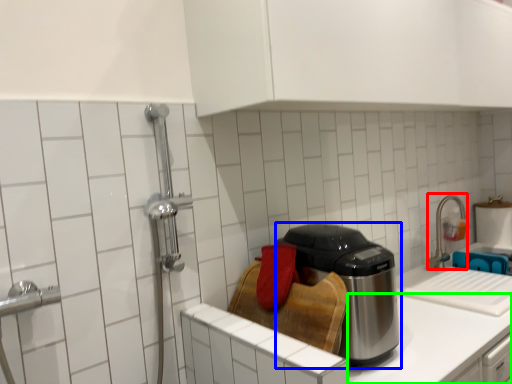
Question: Which object is the closest to the faucet (highlighted by a red box)? Choose among these: kitchen appliance (highlighted by a blue box) or counter top (highlighted by a green box).

Choices:
 (A) kitchen appliance
 (B) counter top

Answer: (B)